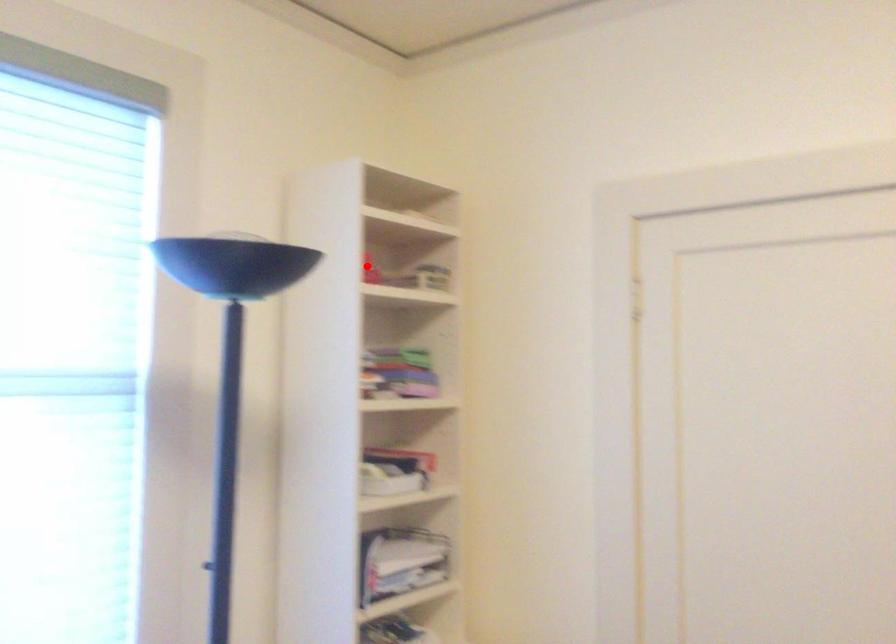
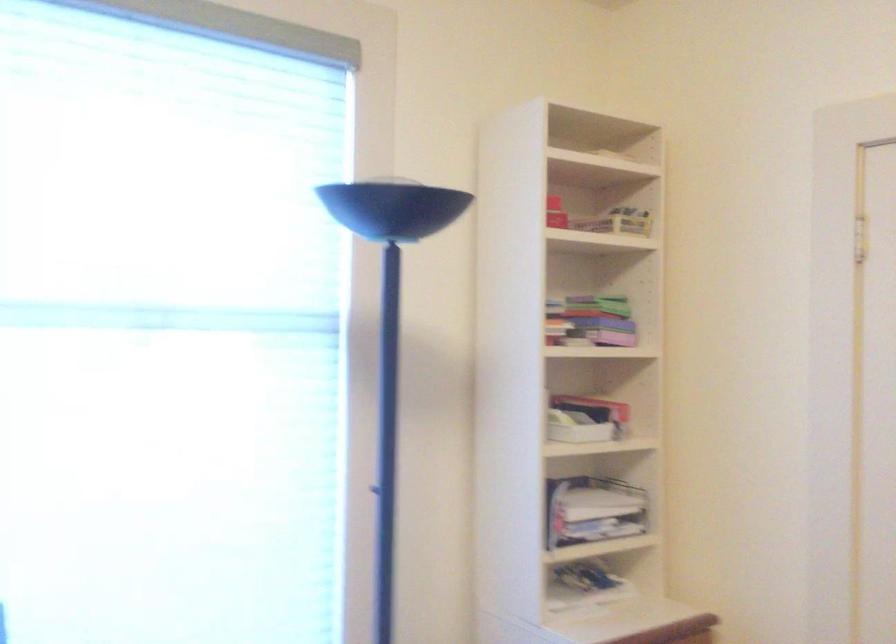
Where in the second image is the point corresponding to the highlighted location from the first image?

(555, 213)